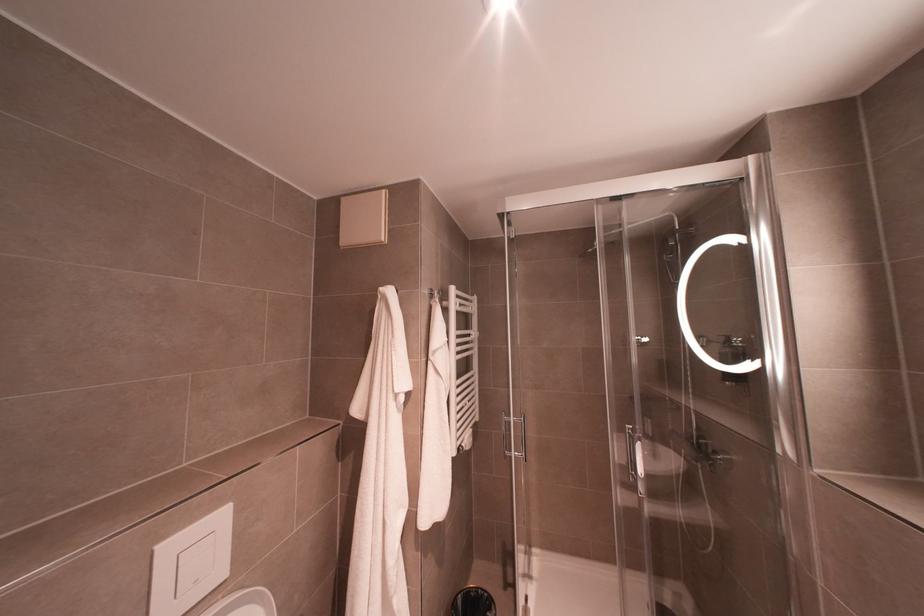
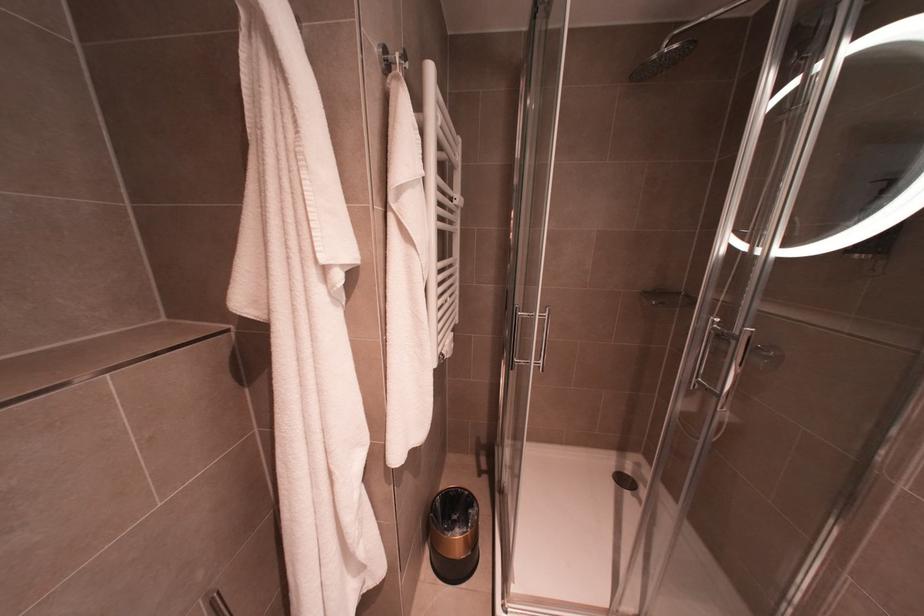
Question: How did the camera likely rotate?

Choices:
 (A) Left
 (B) Right
 (C) Up
 (D) Down

Answer: (D)